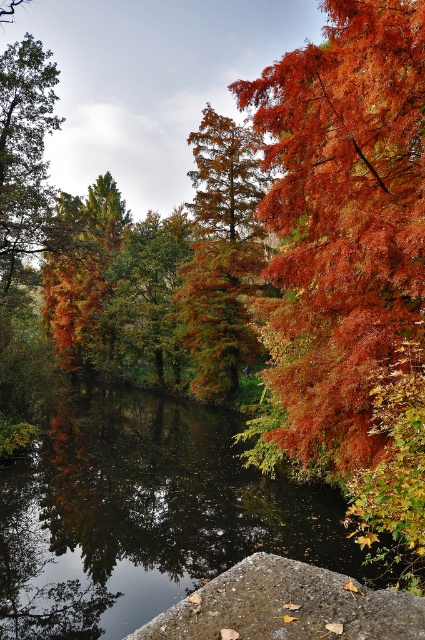
Question: Can you confirm if smooth dark water at center is positioned to the right of orange matte tree at center?

Choices:
 (A) yes
 (B) no

Answer: (B)

Question: Which point appears closest to the camera in this image?

Choices:
 (A) (31, 196)
 (B) (33, 529)
 (C) (204, 301)
 (D) (328, 337)

Answer: (D)

Question: Which object is closer to the camera taking this photo?

Choices:
 (A) green matte tree at left
 (B) orange matte tree at center

Answer: (A)

Question: Does shiny orange leaves at right lie behind smooth dark water at center?

Choices:
 (A) yes
 (B) no

Answer: (A)

Question: Is shiny orange leaves at right below green matte tree at left?

Choices:
 (A) no
 (B) yes

Answer: (B)

Question: Among these objects, which one is nearest to the camera?

Choices:
 (A) smooth dark water at center
 (B) orange matte tree at center
 (C) green matte tree at left
 (D) shiny orange leaves at right

Answer: (A)